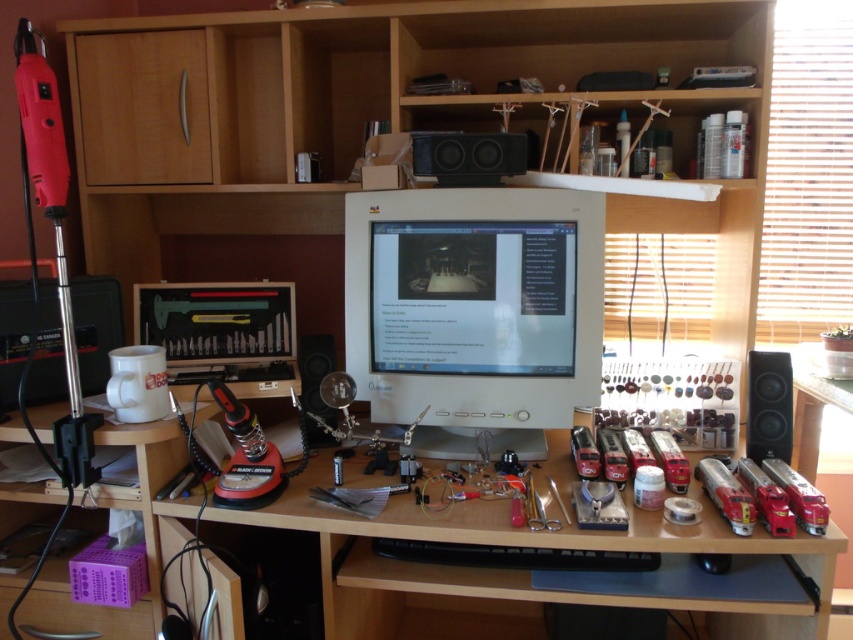
Based on the photo, you are setting up a new desk setup and want to place both the white glossy monitor at center and the black matte speaker at right on your desk. Given that the monitor is larger, where should you position them to ensure they are both visible and functional without overlapping?

Since the white glossy monitor at center is bigger than the black matte speaker at right, position the white glossy monitor at center in the central area of your desk for visibility and place the black matte speaker at right on the side to avoid overlap while ensuring functionality.

You need to place a new keyboard that requires 30 cm of space. The white plastic monitor at center and the matte black speaker at center are currently occupying the central area. Which object should you move to make space?

The matte black speaker at center should be moved because it is smaller than the white plastic monitor at center, so moving it would free up less space but still allow room for the keyboard. Alternatively, moving the monitor might be necessary if the speaker alone isn

Consider the image. You are setting up a new desk layout and want to place a 12 inch wide laptop between the white glossy monitor at center and the black matte speaker at right. Given their widths, will there be enough space for the laptop to fit between them?

The white glossy monitor at center has a larger width than the black matte speaker at right. Since the laptop is 12 inches wide, and the monitor is wider, there should be sufficient space between them to accommodate the laptop.